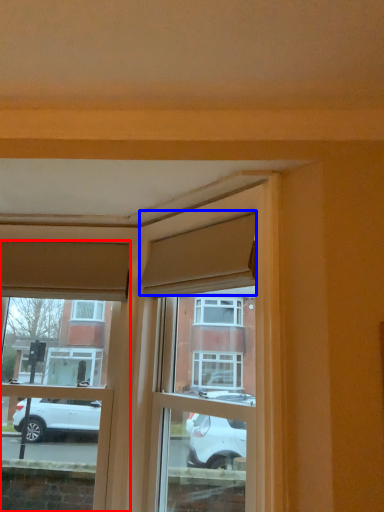
Question: Which object is further to the camera taking this photo, window (highlighted by a red box) or curtain (highlighted by a blue box)?

Choices:
 (A) window
 (B) curtain

Answer: (A)